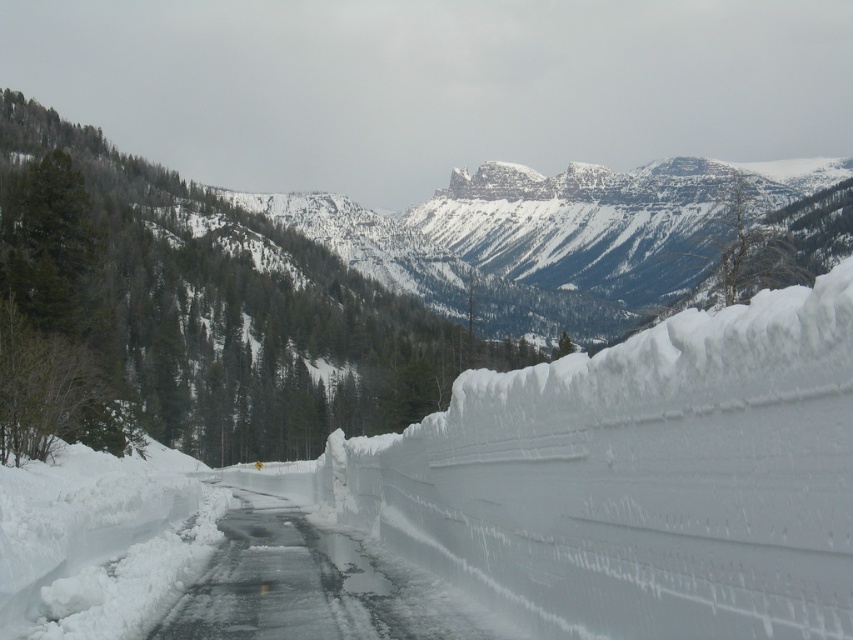
Is snowy mountain at center closer to the viewer compared to icy asphalt road at center?

That is False.

Who is positioned more to the left, snowy mountain at center or icy asphalt road at center?

icy asphalt road at center

Between point (178, 404) and point (229, 522), which one is positioned in front?

Positioned in front is point (229, 522).

The width and height of the screenshot is (853, 640). Find the location of `snowy mountain at center`. snowy mountain at center is located at coordinates (347, 285).